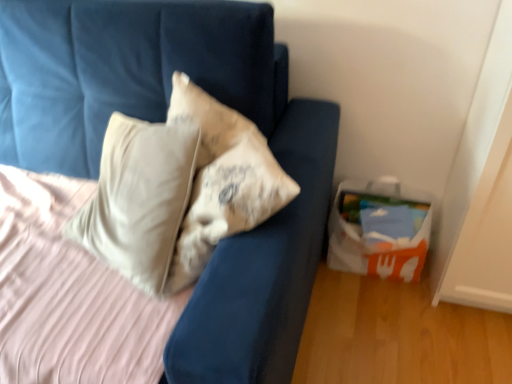
I want to click on white paper bag at lower right, so click(379, 230).

Describe the element at coordinates (379, 230) in the screenshot. I see `white paper bag at lower right` at that location.

Identify the location of velvet blue sofa at upper left. (163, 121).

What do you see at coordinates (163, 121) in the screenshot? This screenshot has width=512, height=384. I see `velvet blue sofa at upper left` at bounding box center [163, 121].

The width and height of the screenshot is (512, 384). What are the coordinates of `white paper bag at lower right` in the screenshot? It's located at (379, 230).

Which object is positioned more to the left, velvet blue sofa at upper left or white paper bag at lower right?

Positioned to the left is velvet blue sofa at upper left.

Who is more distant, velvet blue sofa at upper left or white paper bag at lower right?

white paper bag at lower right is further from the camera.

Is point (309, 150) closer to camera compared to point (361, 265)?

That is True.

From the image's perspective, is velvet blue sofa at upper left beneath white paper bag at lower right?

No, from the image's perspective, velvet blue sofa at upper left is not below white paper bag at lower right.

From a real-world perspective, is velvet blue sofa at upper left over white paper bag at lower right?

Indeed, from a real-world perspective, velvet blue sofa at upper left stands above white paper bag at lower right.

Between velvet blue sofa at upper left and white paper bag at lower right, which one has larger width?

velvet blue sofa at upper left.

Who is taller, velvet blue sofa at upper left or white paper bag at lower right?

With more height is velvet blue sofa at upper left.

Considering the sizes of velvet blue sofa at upper left and white paper bag at lower right in the image, is velvet blue sofa at upper left bigger or smaller than white paper bag at lower right?

Clearly, velvet blue sofa at upper left is larger in size than white paper bag at lower right.

Is white paper bag at lower right surrounded by velvet blue sofa at upper left?

No.

Does velvet blue sofa at upper left touch white paper bag at lower right?

No, velvet blue sofa at upper left is not beside white paper bag at lower right.

Is velvet blue sofa at upper left aimed at white paper bag at lower right?

No, velvet blue sofa at upper left is not oriented towards white paper bag at lower right.

In the scene shown: How different are the orientations of velvet blue sofa at upper left and white paper bag at lower right in degrees?

The angular difference between velvet blue sofa at upper left and white paper bag at lower right is 0.669 degrees.

What are the coordinates of `furniture above the white paper bag at lower right (from a real-world perspective)` in the screenshot? It's located at [x=163, y=121].

Considering the positions of objects white paper bag at lower right and velvet blue sofa at upper left in the image provided, who is more to the left, white paper bag at lower right or velvet blue sofa at upper left?

Positioned to the left is velvet blue sofa at upper left.

In the image, is white paper bag at lower right positioned in front of or behind velvet blue sofa at upper left?

white paper bag at lower right is positioned farther from the viewer than velvet blue sofa at upper left.

In the scene shown: Which is closer, (378, 234) or (123, 51)?

The point (123, 51) is more forward.

Based on the photo, from the image's perspective, relative to velvet blue sofa at upper left, is white paper bag at lower right above or below?

Clearly, from the image's perspective, white paper bag at lower right is below velvet blue sofa at upper left.

From a real-world perspective, is white paper bag at lower right above or below velvet blue sofa at upper left?

white paper bag at lower right is below velvet blue sofa at upper left.

Which of these two, white paper bag at lower right or velvet blue sofa at upper left, is thinner?

white paper bag at lower right is thinner.

In terms of height, does white paper bag at lower right look taller or shorter compared to velvet blue sofa at upper left?

white paper bag at lower right is shorter than velvet blue sofa at upper left.

Looking at the image, does white paper bag at lower right seem bigger or smaller compared to velvet blue sofa at upper left?

In the image, white paper bag at lower right appears to be smaller than velvet blue sofa at upper left.

Would you say white paper bag at lower right is outside velvet blue sofa at upper left?

white paper bag at lower right lies outside velvet blue sofa at upper left's area.

Is white paper bag at lower right touching velvet blue sofa at upper left?

No, white paper bag at lower right is not touching velvet blue sofa at upper left.

Does white paper bag at lower right turn towards velvet blue sofa at upper left?

No, white paper bag at lower right is not turned towards velvet blue sofa at upper left.

Locate an element on the screen. This screenshot has height=384, width=512. furniture on the left side of white paper bag at lower right is located at coordinates (163, 121).

Identify the location of package on the right of the velvet blue sofa at upper left. (379, 230).

Identify the location of furniture that is in front of the white paper bag at lower right. The image size is (512, 384). (163, 121).